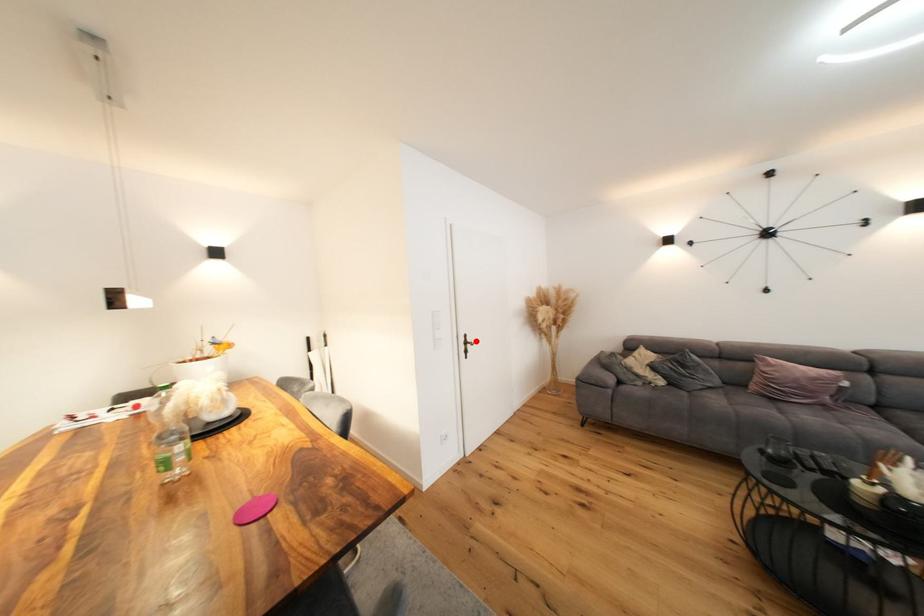
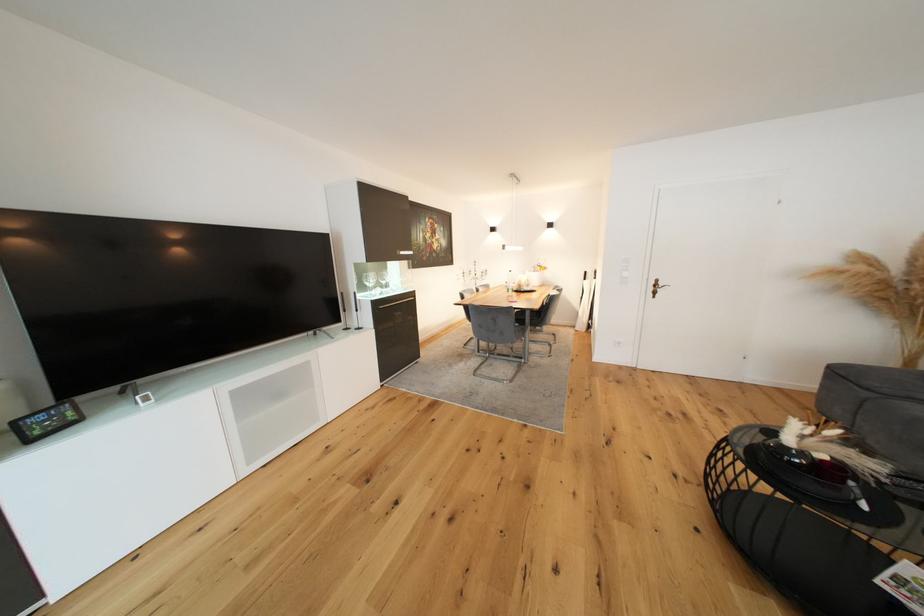
Question: I am providing you with two images of the same scene from different viewpoints. Given a red point in image1, look at the same physical point in image2. Is it:

Choices:
 (A) Closer to the viewpoint
 (B) Farther from the viewpoint

Answer: (A)